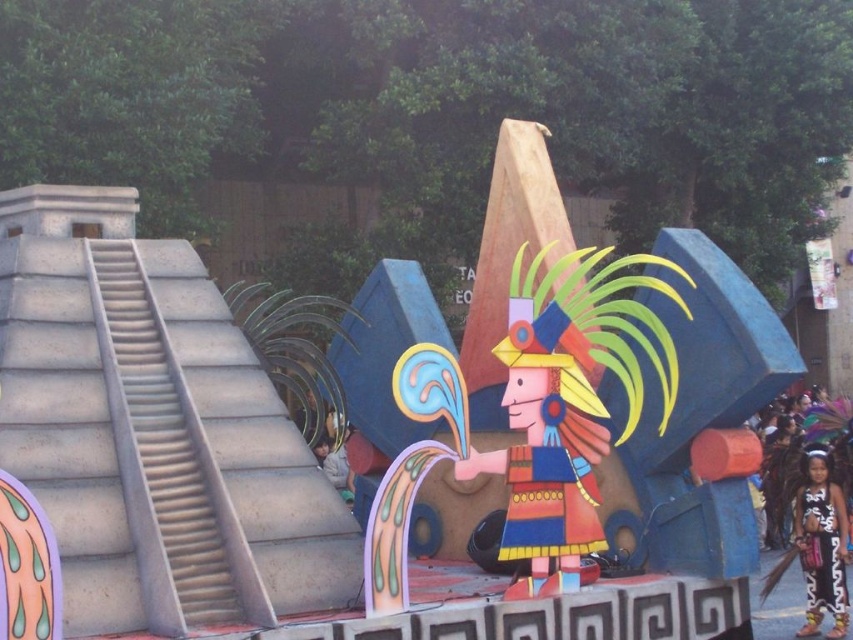
Which is below, black and white costume at center or matte gray jacket at center?

Positioned lower is black and white costume at center.

In order to click on black and white costume at center in this screenshot , I will do `click(792, 515)`.

You are a GUI agent. You are given a task and a screenshot of the screen. Output one action in this format:
    pyautogui.click(x=<x>, y=<y>)
    Task: Click on the black and white costume at center
    
    Given the screenshot: What is the action you would take?
    pyautogui.click(x=792, y=515)

Can you confirm if wooden painted figure at center is thinner than matte gray jacket at center?

In fact, wooden painted figure at center might be wider than matte gray jacket at center.

Can you confirm if wooden painted figure at center is positioned to the left of matte gray jacket at center?

Incorrect, wooden painted figure at center is not on the left side of matte gray jacket at center.

Is point (605, 445) positioned after point (329, 476)?

No, (605, 445) is in front of (329, 476).

Identify the location of wooden painted figure at center. This screenshot has height=640, width=853. (546, 452).

Is black leather dress at lower right smaller than matte gray jacket at center?

Yes, black leather dress at lower right is smaller than matte gray jacket at center.

Looking at this image, can you confirm if black leather dress at lower right is thinner than matte gray jacket at center?

Yes, black leather dress at lower right is thinner than matte gray jacket at center.

Identify the location of black leather dress at lower right. This screenshot has width=853, height=640. (821, 545).